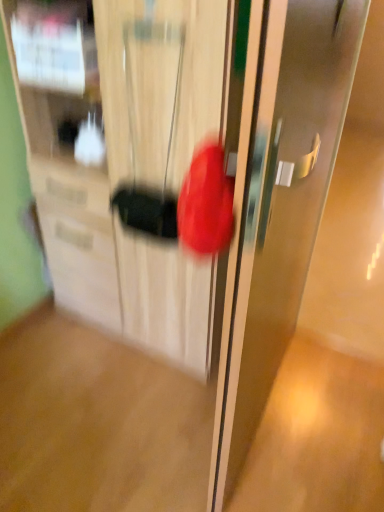
Question: From a real-world perspective, does satin silver door at center sit lower than matte wooden cabinet at center?

Choices:
 (A) yes
 (B) no

Answer: (B)

Question: Is satin silver door at center in front of matte wooden cabinet at center?

Choices:
 (A) yes
 (B) no

Answer: (A)

Question: Is satin silver door at center looking in the opposite direction of matte wooden cabinet at center?

Choices:
 (A) no
 (B) yes

Answer: (B)

Question: From a real-world perspective, is satin silver door at center over matte wooden cabinet at center?

Choices:
 (A) no
 (B) yes

Answer: (B)

Question: Is the position of satin silver door at center more distant than that of matte wooden cabinet at center?

Choices:
 (A) yes
 (B) no

Answer: (B)

Question: Is satin silver door at center facing towards matte wooden cabinet at center?

Choices:
 (A) no
 (B) yes

Answer: (A)

Question: Can you confirm if matte wooden cabinet at center is smaller than satin silver door at center?

Choices:
 (A) yes
 (B) no

Answer: (B)

Question: Is the depth of matte wooden cabinet at center greater than that of satin silver door at center?

Choices:
 (A) no
 (B) yes

Answer: (B)

Question: Can you confirm if matte wooden cabinet at center is taller than satin silver door at center?

Choices:
 (A) no
 (B) yes

Answer: (A)

Question: Is matte wooden cabinet at center wider than satin silver door at center?

Choices:
 (A) no
 (B) yes

Answer: (B)

Question: Does matte wooden cabinet at center turn towards satin silver door at center?

Choices:
 (A) no
 (B) yes

Answer: (A)

Question: Is matte wooden cabinet at center far away from satin silver door at center?

Choices:
 (A) no
 (B) yes

Answer: (A)

Question: From the image's perspective, is satin silver door at center located above or below matte wooden cabinet at center?

Choices:
 (A) below
 (B) above

Answer: (A)